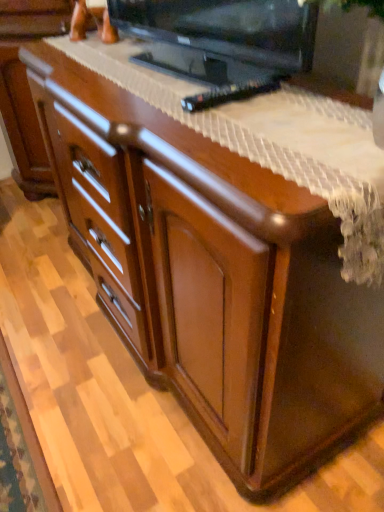
Question: Considering the positions of black glossy television at upper center and black plastic remote at center in the image, is black glossy television at upper center wider or thinner than black plastic remote at center?

Choices:
 (A) thin
 (B) wide

Answer: (B)

Question: Based on their positions, is black glossy television at upper center located to the left or right of black plastic remote at center?

Choices:
 (A) right
 (B) left

Answer: (B)

Question: Choose the correct answer: Is black glossy television at upper center inside black plastic remote at center or outside it?

Choices:
 (A) inside
 (B) outside

Answer: (B)

Question: From a real-world perspective, relative to black glossy television at upper center, is black plastic remote at center vertically above or below?

Choices:
 (A) above
 (B) below

Answer: (B)

Question: From the image's perspective, is black plastic remote at center positioned above or below black glossy television at upper center?

Choices:
 (A) below
 (B) above

Answer: (A)

Question: From their relative heights in the image, would you say black plastic remote at center is taller or shorter than black glossy television at upper center?

Choices:
 (A) tall
 (B) short

Answer: (B)

Question: In terms of width, does black plastic remote at center look wider or thinner when compared to black glossy television at upper center?

Choices:
 (A) wide
 (B) thin

Answer: (B)